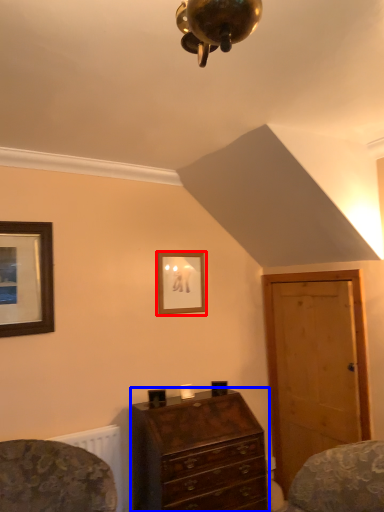
Question: Which object appears farthest to the camera in this image, picture frame (highlighted by a red box) or chest of drawers (highlighted by a blue box)?

Choices:
 (A) picture frame
 (B) chest of drawers

Answer: (A)